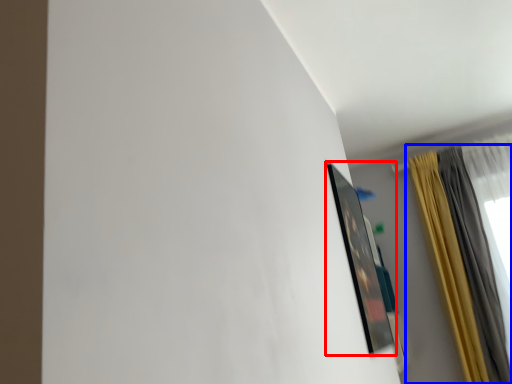
Question: Which object appears closest to the camera in this image, picture frame (highlighted by a red box) or curtain (highlighted by a blue box)?

Choices:
 (A) picture frame
 (B) curtain

Answer: (A)